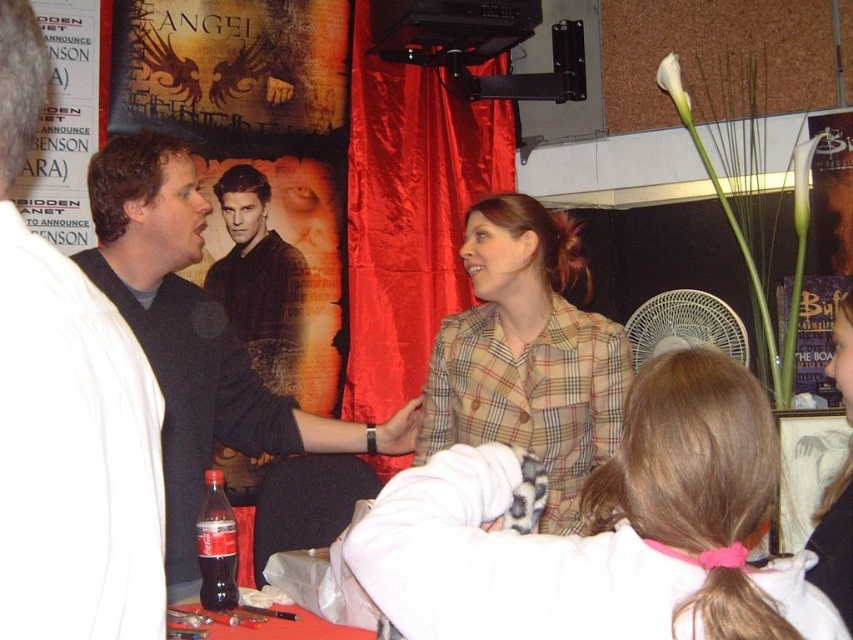
Question: Does pink hairband at center appear on the right side of matte black shirt at left?

Choices:
 (A) no
 (B) yes

Answer: (B)

Question: Which point is closer to the camera taking this photo?

Choices:
 (A) (674, 344)
 (B) (354, 467)
 (C) (27, 330)

Answer: (C)

Question: Is the position of pink hairband at center less distant than that of dark brown leather jacket at center?

Choices:
 (A) yes
 (B) no

Answer: (A)

Question: Which point is farther from the camera taking this photo?

Choices:
 (A) (265, 211)
 (B) (643, 394)
 (C) (579, 275)

Answer: (C)

Question: Can you confirm if matte black shirt at left is wider than plaid fabric jacket at center?

Choices:
 (A) yes
 (B) no

Answer: (A)

Question: Which object is farther from the camera taking this photo?

Choices:
 (A) plaid fabric jacket at center
 (B) pink hairband at center

Answer: (A)